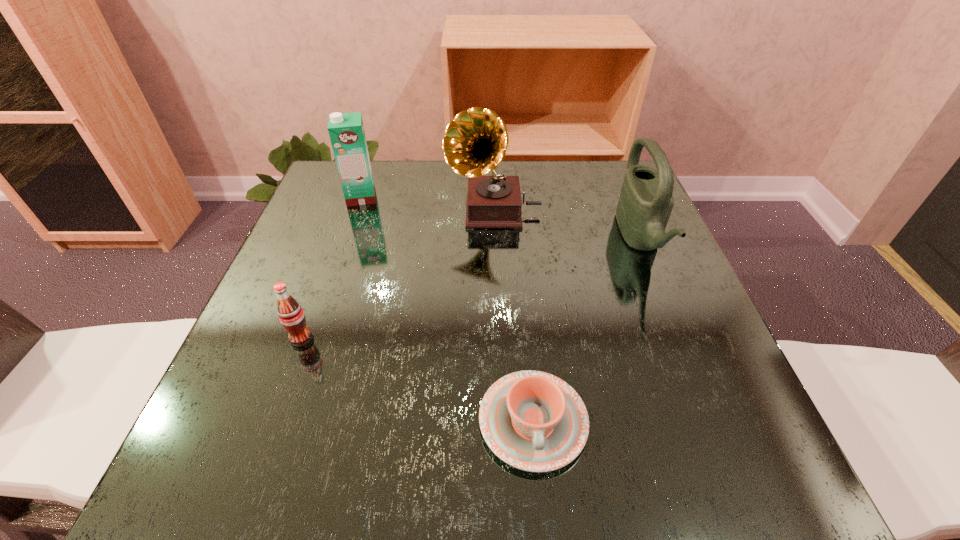
Where is `vacant region between the carton and the nearest object`? vacant region between the carton and the nearest object is located at coordinates (447, 309).

At what (x,y) coordinates should I click in order to perform the action: click on free space that is in between the chinaware and the fourth tallest object. Please return your answer as a coordinate pair (x, y). Looking at the image, I should click on (418, 380).

Find the location of a particular element. The width and height of the screenshot is (960, 540). free space between the carton and the phonograph record is located at coordinates (427, 204).

I want to click on free space between the carton and the phonograph record, so click(x=427, y=204).

Find the location of a particular element. vacant space that's between the carton and the chinaware is located at coordinates (447, 309).

Locate an element on the screen. empty location between the soda and the phonograph record is located at coordinates (397, 275).

Locate an element on the screen. Image resolution: width=960 pixels, height=540 pixels. free space between the soda and the carton is located at coordinates (331, 268).

The image size is (960, 540). I want to click on empty space between the carton and the phonograph record, so click(x=427, y=204).

What are the coordinates of `vacant space that's between the chinaware and the fourth farthest object` in the screenshot? It's located at (418, 380).

Identify which object is located as the fourth nearest to the carton. Please provide its 2D coordinates. Your answer should be formatted as a tuple, i.e. [(x, y)], where the tuple contains the x and y coordinates of a point satisfying the conditions above.

[(646, 201)]